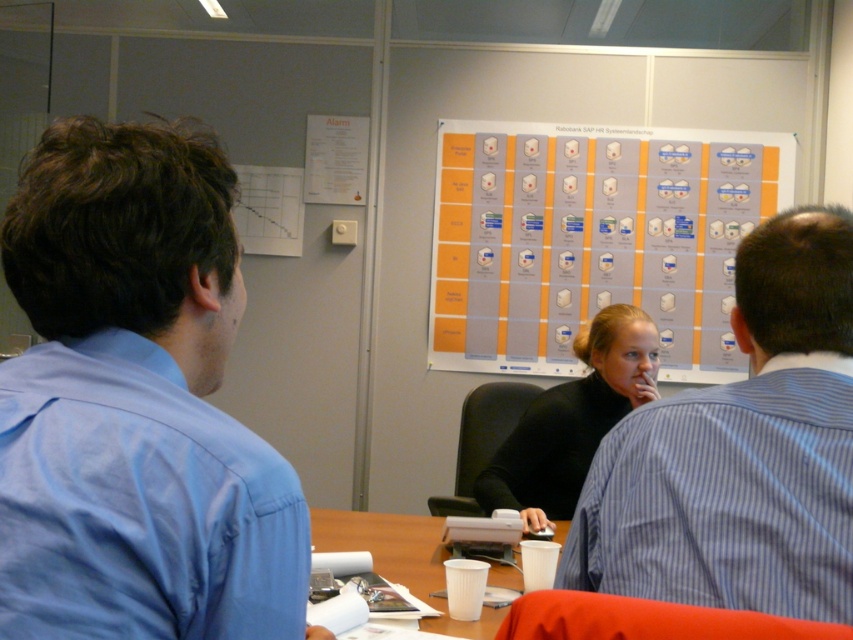
You are organizing a meeting in this room and need to determine seating arrangements. Since the blue striped shirt at upper right and the orange matte poster at center are present, which one has a smaller width?

The blue striped shirt at upper right has a smaller width than the orange matte poster at center.

You are organizing a meeting and need to ensure there is enough space for a new attendee. The blue shirt at left and the white paper cup at center are currently occupying space on the table. Which object takes up more space on the table?

The blue shirt at left is larger in size than the white paper cup at center, so it takes up more space on the table.

You are standing in the meeting room and want to pick up an item from the table. There are two points on the table marked as point 1 at coordinates (x=744, y=468) and point 2 at coordinates (x=653, y=228). Which point is closer to you?

Point 1 at coordinates (x=744, y=468) is closer to the viewer than point 2 at coordinates (x=653, y=228).